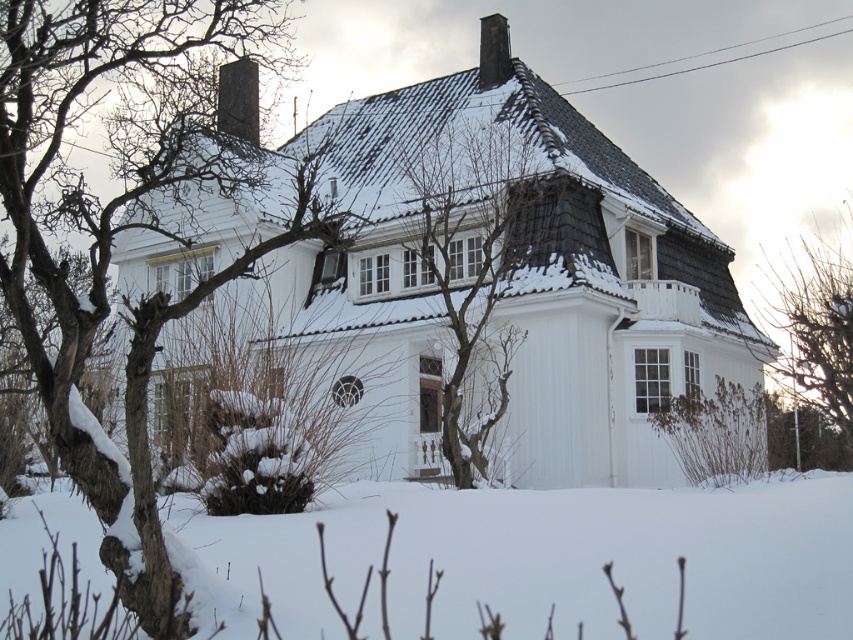
Question: Which point appears farthest from the camera in this image?

Choices:
 (A) (785, 289)
 (B) (131, 513)
 (C) (502, 29)

Answer: (A)

Question: Among these objects, which one is farthest from the camera?

Choices:
 (A) snow-covered branches at left
 (B) dark gray stone chimney at upper center
 (C) bare branches at center

Answer: (B)

Question: Is white powdery snow at lower center below smooth gray chimney at upper center?

Choices:
 (A) no
 (B) yes

Answer: (B)

Question: Is bare branches at center above smooth gray chimney at upper center?

Choices:
 (A) no
 (B) yes

Answer: (A)

Question: Which object appears closest to the camera in this image?

Choices:
 (A) white powdery snow at lower center
 (B) dark gray stone chimney at upper center
 (C) bare branches at right

Answer: (A)

Question: Is snow-covered branches at left bigger than dark gray stone chimney at upper center?

Choices:
 (A) no
 (B) yes

Answer: (B)